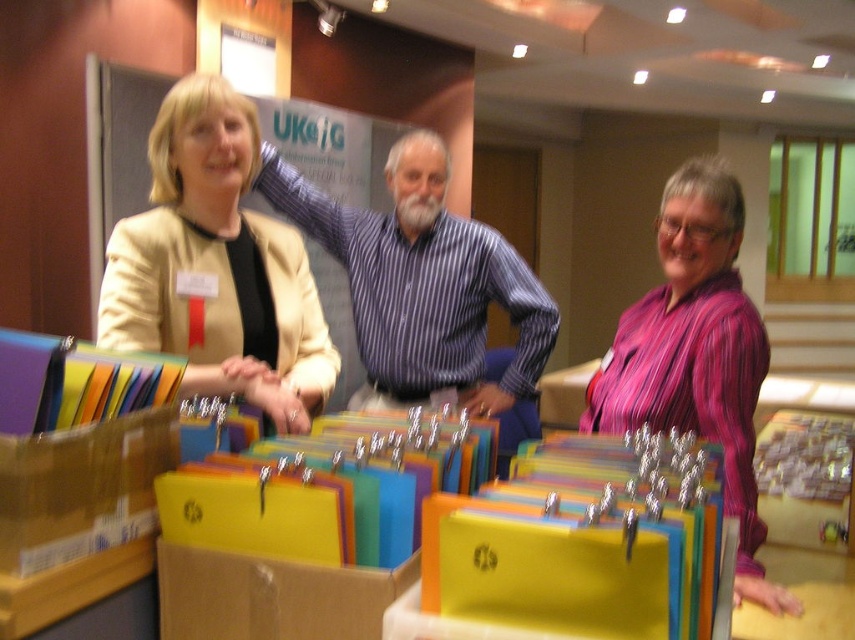
Which is below, matte black jacket at center or matte beige blazer at center?

matte beige blazer at center is below.

Which is behind, point (736, 484) or point (252, 374)?

Positioned behind is point (736, 484).

The image size is (855, 640). What are the coordinates of `matte black jacket at center` in the screenshot? It's located at (694, 352).

Who is more distant from viewer, (x=699, y=323) or (x=541, y=340)?

The point (x=541, y=340) is more distant.

Is matte black jacket at center behind striped cotton shirt at center?

Yes, it is behind striped cotton shirt at center.

Does point (195, 282) come closer to viewer compared to point (437, 230)?

Yes, point (195, 282) is closer to viewer.

Identify the location of matte black jacket at center. The height and width of the screenshot is (640, 855). (694, 352).

Which is behind, point (423, 241) or point (718, 412)?

Positioned behind is point (423, 241).

Looking at this image, can you confirm if striped cotton shirt at center is positioned below purple striped shirt at center?

No, striped cotton shirt at center is not below purple striped shirt at center.

Which is in front, point (450, 221) or point (658, 227)?

Point (658, 227) is more forward.

This screenshot has width=855, height=640. Identify the location of striped cotton shirt at center. (422, 280).